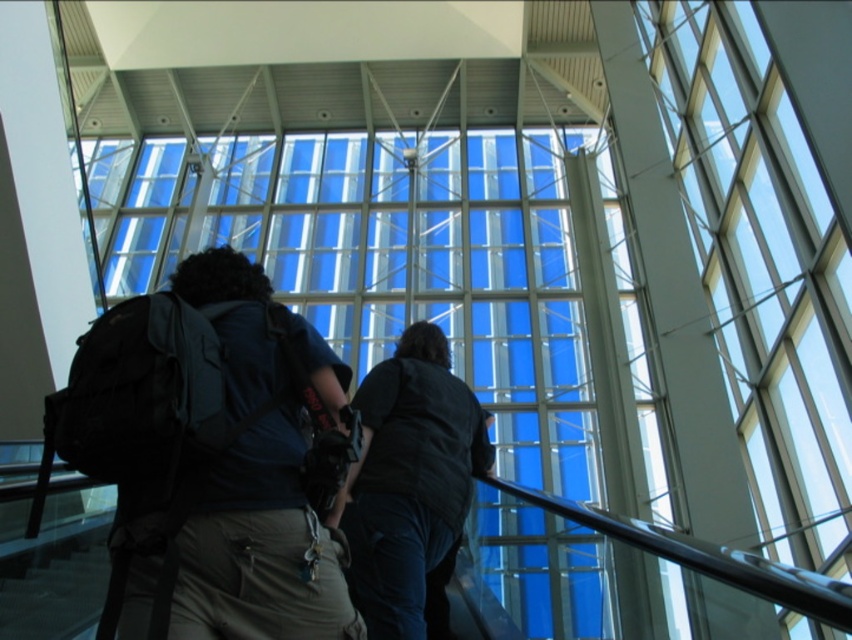
You are standing on the escalator and see the transparent glass window at center and the dark blue fabric backpack at center. Which object is located to the right when viewed from your perspective?

The transparent glass window at center is positioned on the right side of the dark blue fabric backpack at center, so it is located to the right.

You are standing at the bottom of the escalator in the airport scene. There are two points marked on the escalator steps. The first point is at coordinate point (689,163), and the second is at point (369,499). If you want to reach the point that is closer to the top of the escalator, which coordinate should you aim for?

Point (689,163) is behind point (369,499), so it is closer to the top of the escalator. Therefore, you should aim for point (689,163).